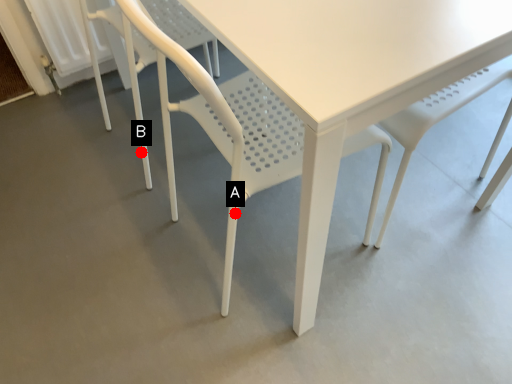
Question: Two points are circled on the image, labeled by A and B beside each circle. Which point is farther from the camera taking this photo?

Choices:
 (A) A is further
 (B) B is further

Answer: (B)